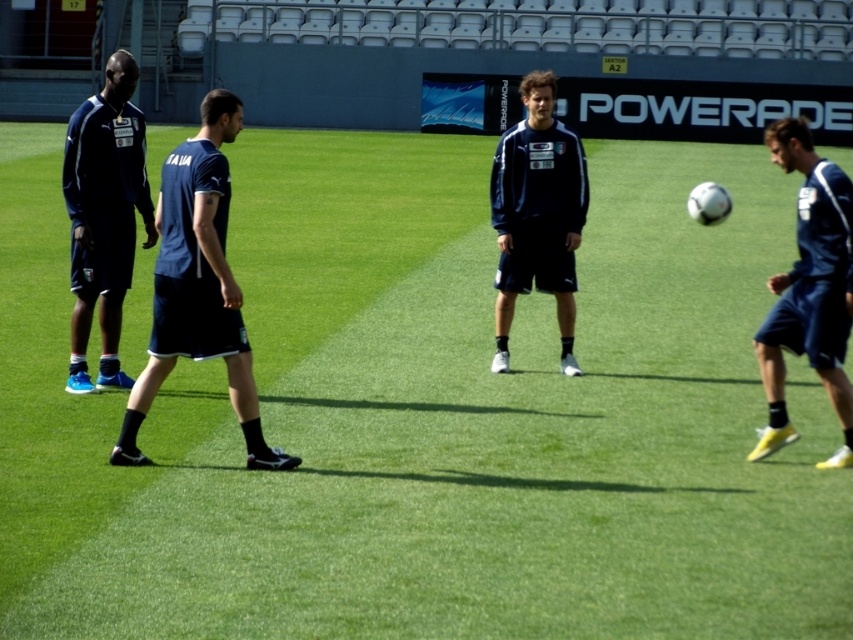
You are a coach observing the soccer training session. You notice two pairs of shorts worn by the players. The dark blue fabric shorts at center and the matte blue shorts at left. Which pair of shorts has a shorter length?

The dark blue fabric shorts at center has a lesser height compared to matte blue shorts at left, so the dark blue fabric shorts at center are shorter in length.

You are a coach observing the soccer training session. You notice two sets of shorts worn by the players. Which player is wearing the dark blue fabric shorts at center? Is it the one to the right or left of the matte blue shorts at left?

The dark blue fabric shorts at center are positioned to the right of the matte blue shorts at left, so the player wearing dark blue fabric shorts at center is to the right of the player in matte blue shorts at left.

You are a soccer coach observing the training session. You notice two players wearing dark blue fabric shorts at center and dark blue shorts at right. Which player is positioned closer to the left side of the field?

The dark blue fabric shorts at center is positioned to the left of dark blue shorts at right, so the player wearing dark blue fabric shorts at center is closer to the left side of the field.